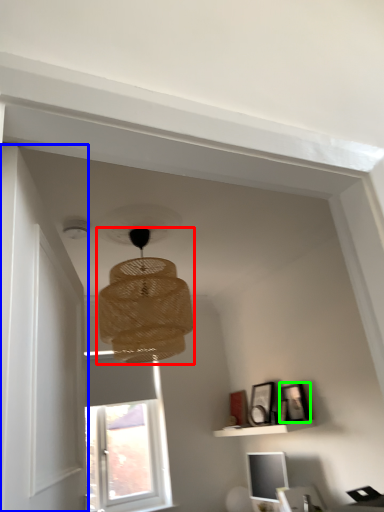
Question: Based on their relative distances, which object is farther from lamp (highlighted by a red box)? Choose from door (highlighted by a blue box) and picture frame (highlighted by a green box).

Choices:
 (A) door
 (B) picture frame

Answer: (B)